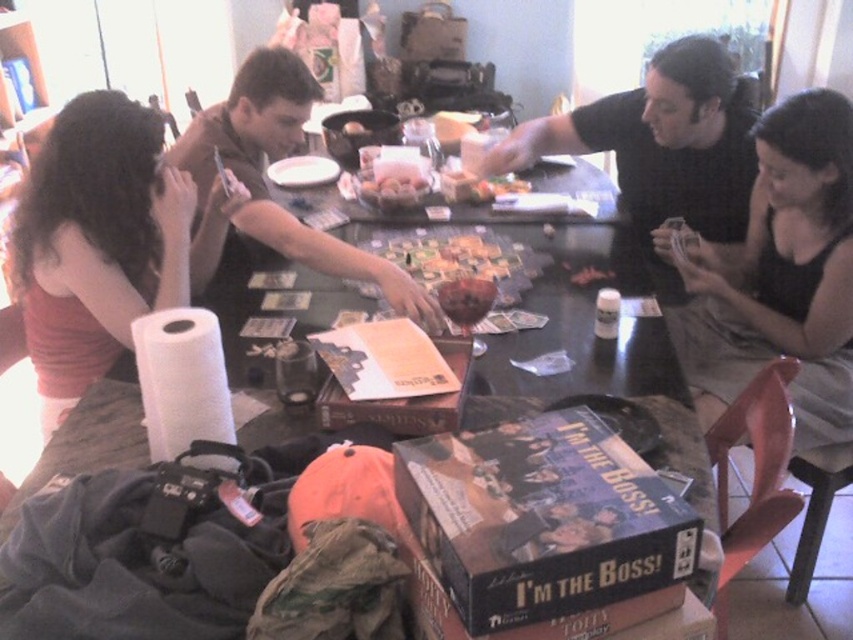
You are a participant in the board game session at the table. You need to place a new game piece at point A and point B. If point A is at coordinates point (567, 138) and point B is at coordinates point (258, 177), which point is closer to you?

Point B at coordinates point (258, 177) is closer to you because it is in front of point A at coordinates point (567, 138).

You are a photographer trying to capture a candid shot of the group. You notice the matte red shirt at left and the black matte shirt at upper right. Which shirt is positioned lower in the image?

The matte red shirt at left is located below the black matte shirt at upper right, so the matte red shirt at left is positioned lower in the image.